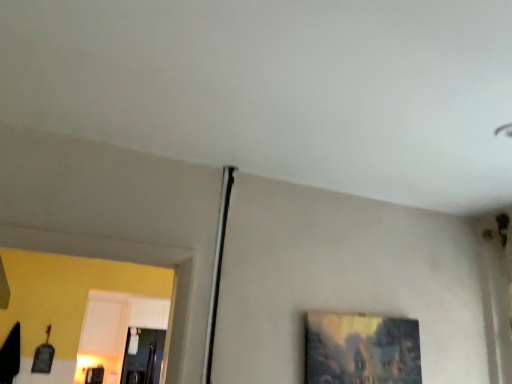
Question: From the image's perspective, is matte wooden picture frame at lower right above or below transparent glass door at lower left?

Choices:
 (A) below
 (B) above

Answer: (B)

Question: In the image, is matte wooden picture frame at lower right positioned in front of or behind transparent glass door at lower left?

Choices:
 (A) behind
 (B) front

Answer: (B)

Question: Considering the positions of matte wooden picture frame at lower right and transparent glass door at lower left in the image, is matte wooden picture frame at lower right wider or thinner than transparent glass door at lower left?

Choices:
 (A) wide
 (B) thin

Answer: (B)

Question: From a real-world perspective, is transparent glass door at lower left physically located above or below matte wooden picture frame at lower right?

Choices:
 (A) above
 (B) below

Answer: (B)

Question: Looking at the image, does transparent glass door at lower left seem bigger or smaller compared to matte wooden picture frame at lower right?

Choices:
 (A) big
 (B) small

Answer: (A)

Question: Is point (150, 362) positioned closer to the camera than point (320, 336)?

Choices:
 (A) farther
 (B) closer

Answer: (A)

Question: Do you think transparent glass door at lower left is within matte wooden picture frame at lower right, or outside of it?

Choices:
 (A) inside
 (B) outside

Answer: (B)